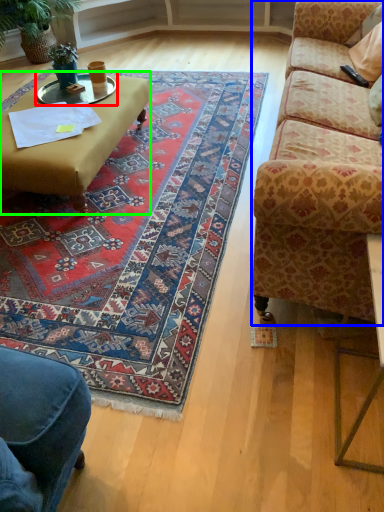
Question: Which object is positioned farthest from glass table (highlighted by a red box)? Select from studio couch (highlighted by a blue box) and coffee table (highlighted by a green box).

Choices:
 (A) studio couch
 (B) coffee table

Answer: (A)